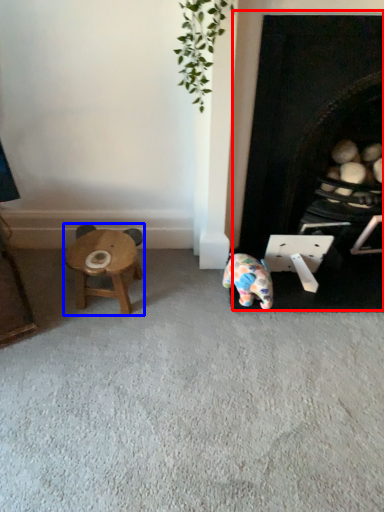
Question: Among these objects, which one is nearest to the camera, fireplace (highlighted by a red box) or stool (highlighted by a blue box)?

Choices:
 (A) fireplace
 (B) stool

Answer: (A)